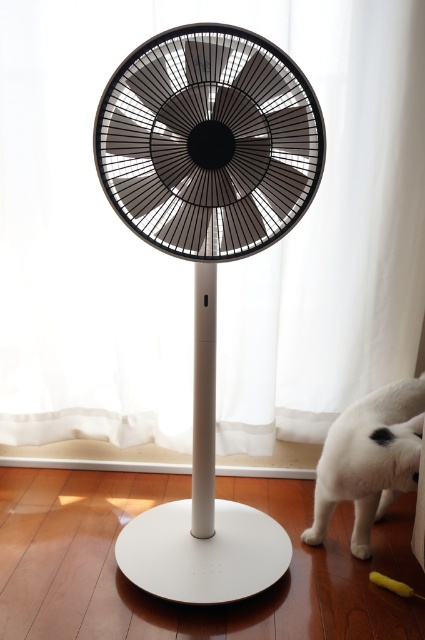
Question: Which point is farther to the camera?

Choices:
 (A) (388, 449)
 (B) (159, 116)

Answer: (A)

Question: Can you confirm if black matte fan at center is thinner than white fur cat at lower right?

Choices:
 (A) no
 (B) yes

Answer: (A)

Question: Does black matte fan at center have a greater width compared to white fur cat at lower right?

Choices:
 (A) yes
 (B) no

Answer: (A)

Question: Does black matte fan at center have a smaller size compared to white fur cat at lower right?

Choices:
 (A) no
 (B) yes

Answer: (A)